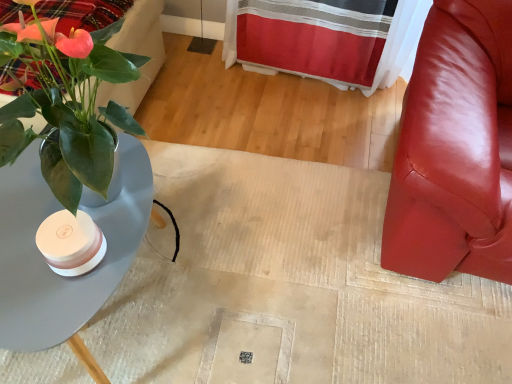
Question: Is point (90, 288) positioned closer to the camera than point (385, 193)?

Choices:
 (A) closer
 (B) farther

Answer: (A)

Question: Looking at the image, does matte gray table at left seem bigger or smaller compared to matte white vase at left?

Choices:
 (A) big
 (B) small

Answer: (A)

Question: Considering the real-world distances, which object is closest to the glossy leather chair at right?

Choices:
 (A) matte gray table at left
 (B) green glossy plant at left
 (C) matte white vase at left
 (D) velvet plaid bedding at upper left

Answer: (C)

Question: Which of these objects is positioned farthest from the green glossy plant at left?

Choices:
 (A) matte white vase at left
 (B) velvet plaid bedding at upper left
 (C) glossy leather chair at right
 (D) matte gray table at left

Answer: (C)